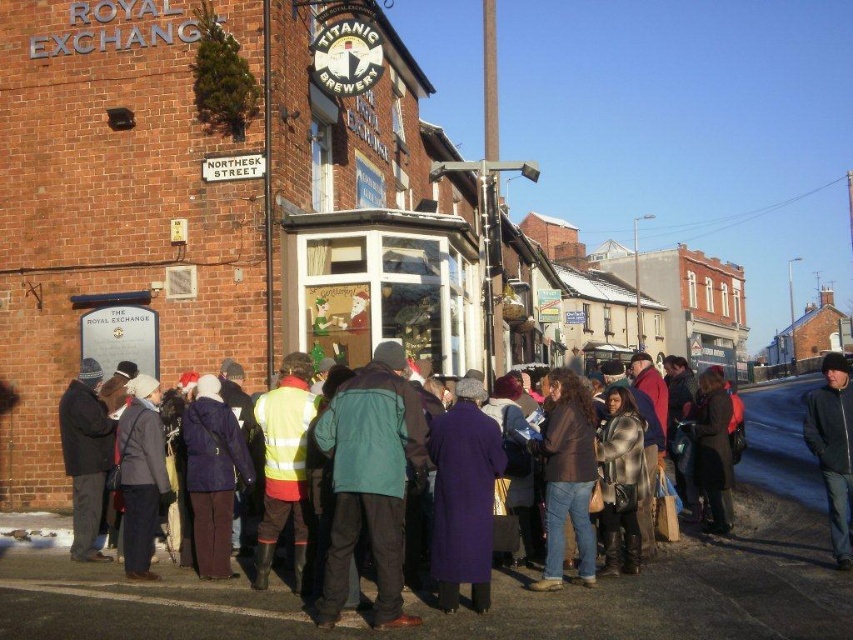
Is matte green jacket at center shorter than matte black coat at lower left?

Indeed, matte green jacket at center has a lesser height compared to matte black coat at lower left.

Which is behind, point (432, 628) or point (131, 525)?

Positioned behind is point (131, 525).

The width and height of the screenshot is (853, 640). What do you see at coordinates (410, 605) in the screenshot?
I see `matte green jacket at center` at bounding box center [410, 605].

Identify the location of matte green jacket at center. The image size is (853, 640). (410, 605).

Is matte green jacket at center further to camera compared to purple wool coat at center?

That is True.

Who is higher up, matte green jacket at center or purple wool coat at center?

Positioned higher is purple wool coat at center.

Image resolution: width=853 pixels, height=640 pixels. Describe the element at coordinates (410, 605) in the screenshot. I see `matte green jacket at center` at that location.

Identify the location of matte green jacket at center. The height and width of the screenshot is (640, 853). (410, 605).

Does dark brown leather jacket at center have a greater width compared to matte black coat at lower left?

A: No, dark brown leather jacket at center is not wider than matte black coat at lower left.

This screenshot has width=853, height=640. Identify the location of dark brown leather jacket at center. (567, 477).

Is point (549, 467) farther from camera compared to point (165, 477)?

No.

Find the location of a particular element. dark brown leather jacket at center is located at coordinates (567, 477).